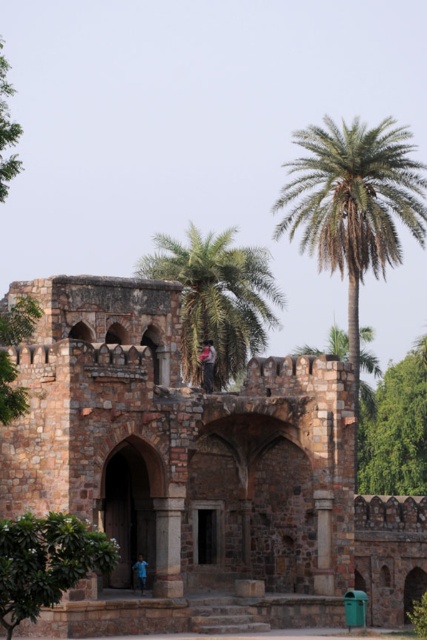
Who is higher up, brown stone fort at center or green leafy palm at upper right?

green leafy palm at upper right

Is brown stone fort at center shorter than green leafy palm at upper right?

Yes, brown stone fort at center is shorter than green leafy palm at upper right.

Between point (167, 392) and point (327, 141), which one is positioned behind?

Positioned behind is point (327, 141).

Where is `brown stone fort at center`? brown stone fort at center is located at coordinates (198, 468).

Can you confirm if green leafy palm at upper right is positioned to the left of green leafy palm tree at center?

In fact, green leafy palm at upper right is to the right of green leafy palm tree at center.

Can you confirm if green leafy palm at upper right is positioned to the right of green leafy palm tree at center?

Indeed, green leafy palm at upper right is positioned on the right side of green leafy palm tree at center.

Is point (353, 252) farther from viewer compared to point (266, 268)?

No, it is in front of (266, 268).

At what (x,y) coordinates should I click in order to perform the action: click on green leafy palm at upper right. Please return your answer as a coordinate pair (x, y). This screenshot has width=427, height=640. Looking at the image, I should click on (353, 204).

Can you confirm if green leafy palm at upper right is smaller than green leafy tree at lower left?

No, green leafy palm at upper right is not smaller than green leafy tree at lower left.

Where is `green leafy palm at upper right`? The image size is (427, 640). green leafy palm at upper right is located at coordinates (353, 204).